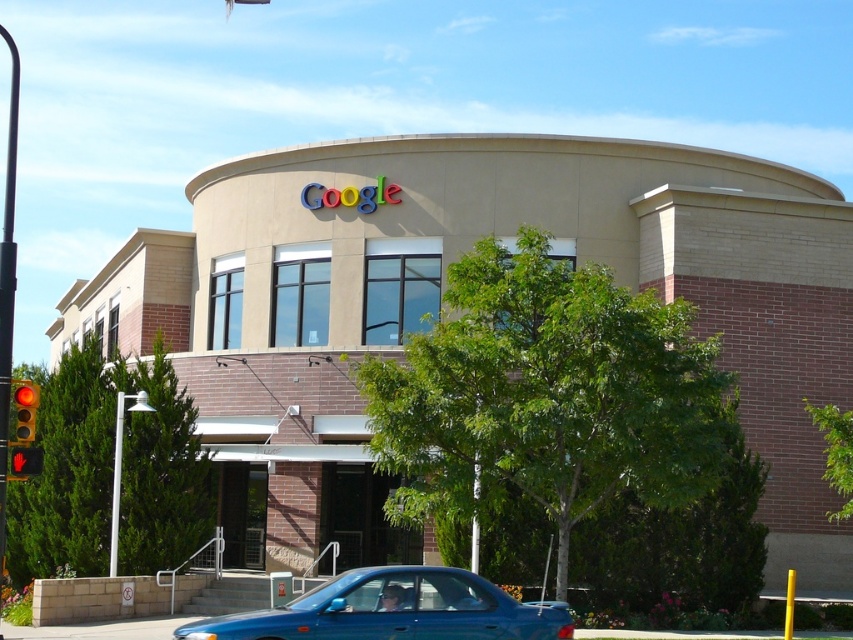
Question: Can you confirm if blue matte car at lower center is positioned to the left of red glass traffic light at left?

Choices:
 (A) no
 (B) yes

Answer: (A)

Question: Which object is closer to the camera taking this photo?

Choices:
 (A) red glass traffic light at left
 (B) blue matte car at lower center

Answer: (B)

Question: Which object appears farthest from the camera in this image?

Choices:
 (A) red glass traffic light at left
 (B) blue matte car at lower center

Answer: (A)

Question: Is blue matte car at lower center above red glass traffic light at left?

Choices:
 (A) yes
 (B) no

Answer: (B)

Question: Does blue matte car at lower center have a smaller size compared to red glass traffic light at left?

Choices:
 (A) yes
 (B) no

Answer: (B)